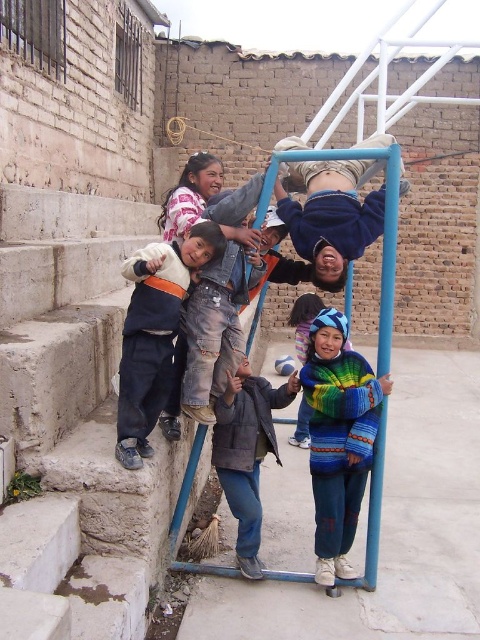
Is denim jacket at left closer to the viewer compared to blue fleece jacket at center?

Yes.

Which is below, denim jacket at left or blue fleece jacket at center?

denim jacket at left is lower down.

I want to click on denim jacket at left, so click(x=155, y=332).

Between point (347, 563) and point (300, 442), which one is positioned behind?

The point (300, 442) is more distant.

Is multicolored knitted sweater at center taller than rainbow knitted sweater at center?

Correct, multicolored knitted sweater at center is much taller as rainbow knitted sweater at center.

You are a GUI agent. You are given a task and a screenshot of the screen. Output one action in this format:
    pyautogui.click(x=<x>, y=<y>)
    Task: Click on the multicolored knitted sweater at center
    
    Given the screenshot: What is the action you would take?
    pos(338,436)

Which of these two, blue fleece jacket at center or dark gray jacket at center, stands taller?

With more height is dark gray jacket at center.

Is blue fleece jacket at center below dark gray jacket at center?

Incorrect, blue fleece jacket at center is not positioned below dark gray jacket at center.

Between point (280, 147) and point (273, 406), which one is positioned in front?

Point (280, 147) is in front.

Where is `blue fleece jacket at center`? This screenshot has width=480, height=640. blue fleece jacket at center is located at coordinates (331, 218).